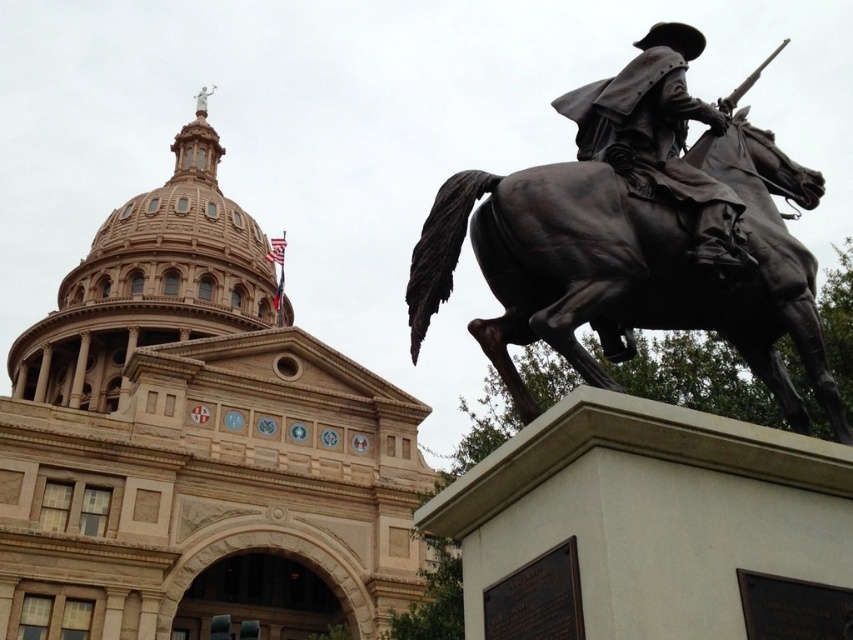
Looking at this image, you are an art student analyzing the statue and the nearby bronze structure. You need to know which object is wider. Which one has a greater width between the bronze at right and the bronze statue at center?

The bronze at right has a greater width than the bronze statue at center.

You are a tour guide leading a group to the bronze statue at center. A tourist asks if they can touch the bronze at right near the statue. Considering the rule that visitors must stay at least 3 meters away from all statues, can they safely touch it?

The bronze at right is 2.96 meters away from bronze statue at center. Since the required distance is 3 meters, touching the bronze at right would violate the rule as it is slightly closer than the allowed distance.

You are a tour guide explaining the historical site to visitors. You point out the bronze at right and the bronze statue at center. Which one is closer to the visitors standing in front of the building?

The bronze at right is closer to the visitors because it is positioned in front of the bronze statue at center, meaning it is nearer to the front of the building where the visitors are standing.